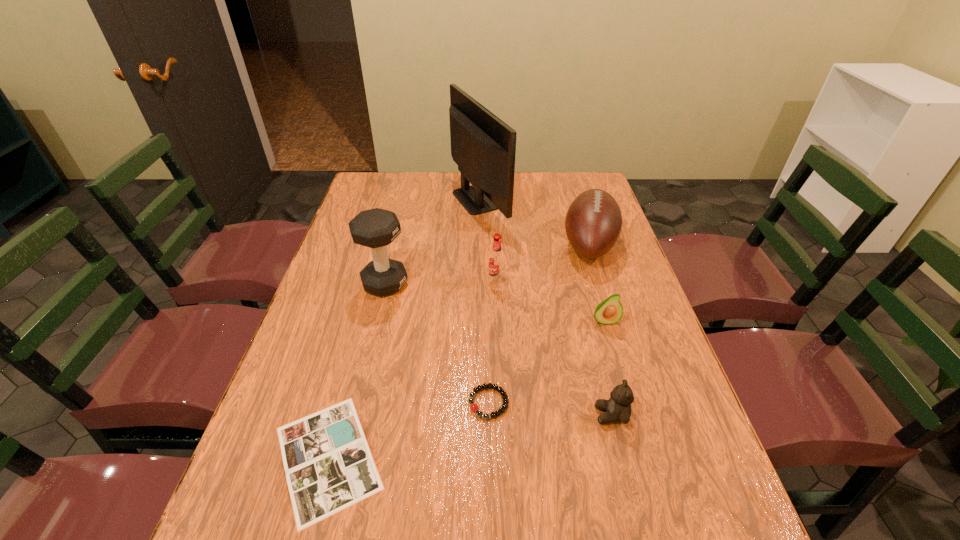
Find the location of a particular element. The width and height of the screenshot is (960, 540). book at the left edge is located at coordinates (329, 466).

The width and height of the screenshot is (960, 540). I want to click on football (American) that is at the right edge, so click(x=593, y=222).

The image size is (960, 540). In order to click on avocado at the right edge in this screenshot , I will do `click(609, 311)`.

This screenshot has height=540, width=960. Find the location of `teddy bear that is at the right edge`. teddy bear that is at the right edge is located at coordinates (618, 408).

This screenshot has height=540, width=960. I want to click on free space at the far edge of the desktop, so click(529, 172).

Where is `vacant space at the left edge of the desktop`? Image resolution: width=960 pixels, height=540 pixels. vacant space at the left edge of the desktop is located at coordinates (341, 378).

In the image, there is a desktop. Where is `vacant space at the right edge`? vacant space at the right edge is located at coordinates (612, 252).

Where is `blank area at the far right corner`? The image size is (960, 540). blank area at the far right corner is located at coordinates (572, 192).

You are a GUI agent. You are given a task and a screenshot of the screen. Output one action in this format:
    pyautogui.click(x=<x>, y=<y>)
    Task: Click on the unoccupied area between the football (American) and the book
    Image resolution: width=960 pixels, height=540 pixels.
    Given the screenshot: What is the action you would take?
    pyautogui.click(x=458, y=351)

Find the location of `free point between the fifth farthest object and the book`. free point between the fifth farthest object and the book is located at coordinates (467, 389).